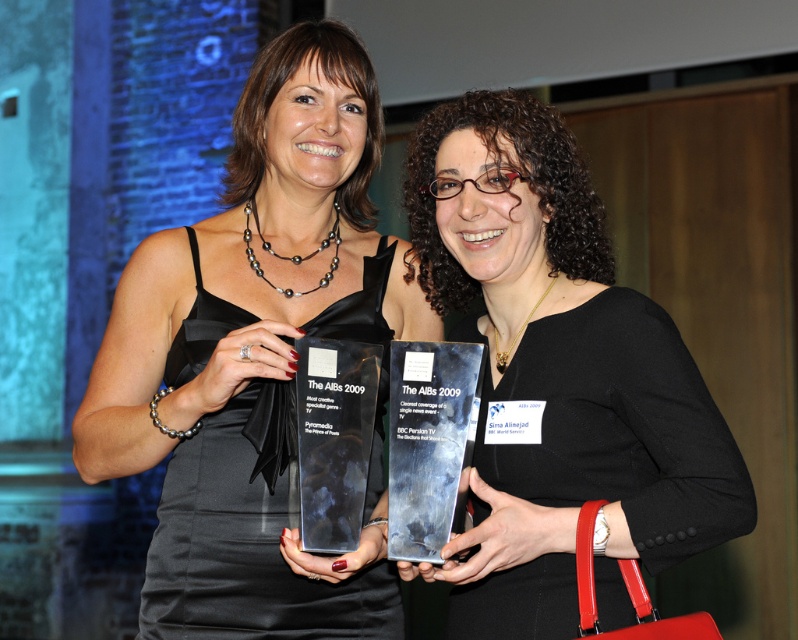
Question: Which of the following is the farthest from the observer?

Choices:
 (A) (243, 374)
 (B) (431, 202)

Answer: (B)

Question: Does satin black dress at center come behind matte black award at center?

Choices:
 (A) yes
 (B) no

Answer: (A)

Question: Is satin black dress at center positioned in front of matte black award at center?

Choices:
 (A) no
 (B) yes

Answer: (A)

Question: Which point appears closest to the camera in this image?

Choices:
 (A) (350, 92)
 (B) (571, 192)

Answer: (B)

Question: Among these points, which one is nearest to the camera?

Choices:
 (A) (599, 435)
 (B) (164, 296)

Answer: (A)

Question: From the image, what is the correct spatial relationship of satin black dress at center in relation to matte black award at center?

Choices:
 (A) right
 (B) left

Answer: (B)